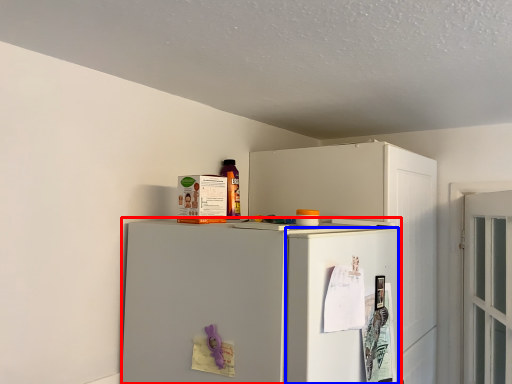
Question: Which point is closer to the camera, refrigerator (highlighted by a red box) or door (highlighted by a blue box)?

Choices:
 (A) refrigerator
 (B) door

Answer: (A)